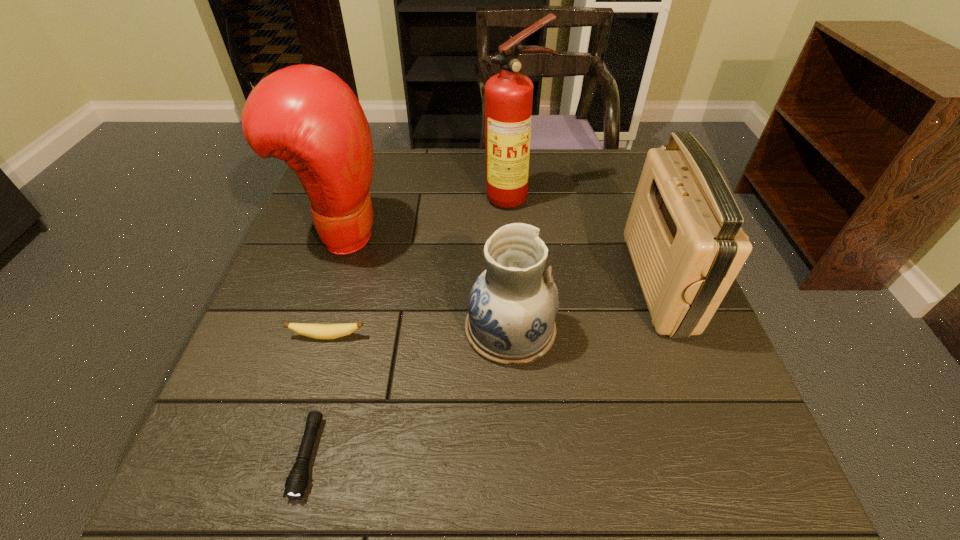
The height and width of the screenshot is (540, 960). I want to click on free location that satisfies the following two spatial constraints: 1. on the striking surface of the boxing glove; 2. on the left side of the pottery, so click(310, 329).

Identify the location of free location that satisfies the following two spatial constraints: 1. on the front-facing side of the fire extinguisher; 2. on the striking surface of the boxing glove. This screenshot has width=960, height=540. (x=516, y=234).